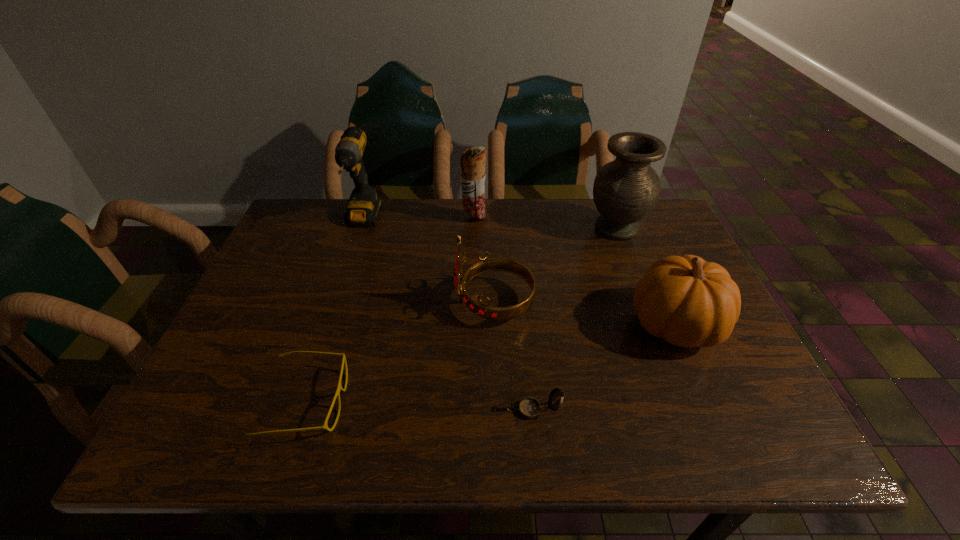
You are a GUI agent. You are given a task and a screenshot of the screen. Output one action in this format:
    pyautogui.click(x=<x>, y=<y>)
    Task: Click on the free space located 0.310m on the front-facing side of the tiara
    The height and width of the screenshot is (540, 960).
    Given the screenshot: What is the action you would take?
    pyautogui.click(x=326, y=303)

Locate an element on the screen. free region located on the front-facing side of the tiara is located at coordinates (343, 303).

Locate an element on the screen. The height and width of the screenshot is (540, 960). vacant space located 0.110m on the front-facing side of the tiara is located at coordinates (409, 303).

The image size is (960, 540). I want to click on vacant position located on the left of the pumpkin, so click(541, 325).

Locate an element on the screen. vacant space located 0.210m on the face of the compass is located at coordinates (399, 410).

Find the location of a particular element. vacant space located 0.090m on the face of the compass is located at coordinates (461, 410).

I want to click on vacant region located on the face of the compass, so click(344, 410).

Where is `free region located 0.140m in front of the lenses of the spectacles`? The height and width of the screenshot is (540, 960). free region located 0.140m in front of the lenses of the spectacles is located at coordinates (416, 402).

I want to click on vase positioned at the far edge, so click(x=625, y=190).

You are a GUI agent. You are given a task and a screenshot of the screen. Output one action in this format:
    pyautogui.click(x=<x>, y=<y>)
    Task: Click on the drill that is positioned at the far edge
    
    Given the screenshot: What is the action you would take?
    pyautogui.click(x=364, y=204)